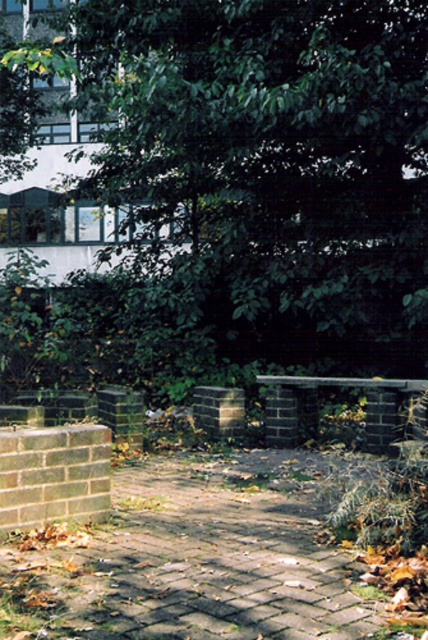
Question: Does green leafy tree at upper center come behind brick paved path at center?

Choices:
 (A) no
 (B) yes

Answer: (B)

Question: Which object is farther from the camera taking this photo?

Choices:
 (A) green leafy tree at upper center
 (B) brick paved path at center

Answer: (A)

Question: Can you confirm if green leafy tree at upper center is positioned above brick paved path at center?

Choices:
 (A) no
 (B) yes

Answer: (B)

Question: Does green leafy tree at upper center appear under brick paved path at center?

Choices:
 (A) no
 (B) yes

Answer: (A)

Question: Which of the following is the farthest from the observer?

Choices:
 (A) green leafy tree at upper center
 (B) brick paved path at center

Answer: (A)

Question: Among these objects, which one is nearest to the camera?

Choices:
 (A) brick paved path at center
 (B) green leafy tree at upper center

Answer: (A)